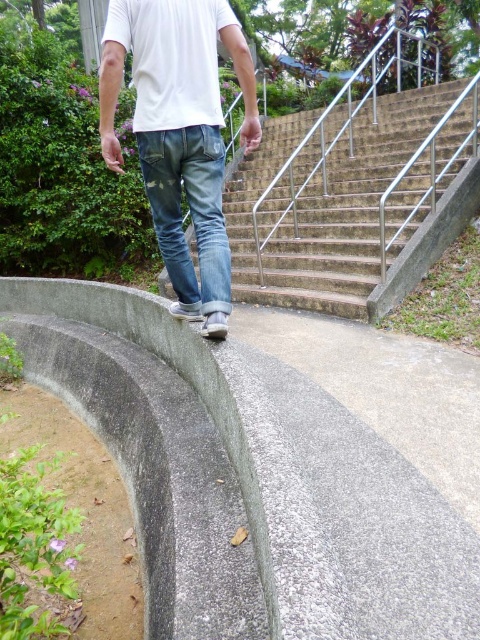
Question: Is white matte t-shirt at upper center further to camera compared to denim/jeans at center?

Choices:
 (A) no
 (B) yes

Answer: (A)

Question: Considering the relative positions of concrete stairs at center and white matte t-shirt at upper center in the image provided, where is concrete stairs at center located with respect to white matte t-shirt at upper center?

Choices:
 (A) left
 (B) right

Answer: (B)

Question: Which point is farther from the camera taking this photo?

Choices:
 (A) (188, 168)
 (B) (139, 52)
 (C) (297, 122)

Answer: (C)

Question: Which object is the closest to the denim jeans at center?

Choices:
 (A) concrete stairs at center
 (B) denim/jeans at center
 (C) white matte t-shirt at upper center

Answer: (B)

Question: Estimate the real-world distances between objects in this image. Which object is closer to the white matte t-shirt at upper center?

Choices:
 (A) denim jeans at center
 (B) denim/jeans at center
 (C) concrete stairs at center

Answer: (A)

Question: Is concrete stairs at center to the left of denim/jeans at center from the viewer's perspective?

Choices:
 (A) no
 (B) yes

Answer: (A)